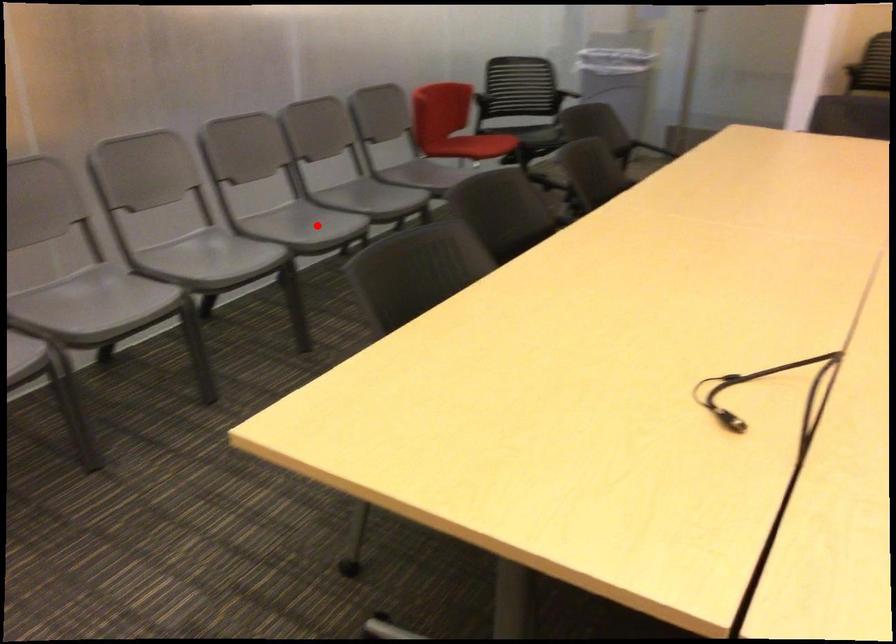
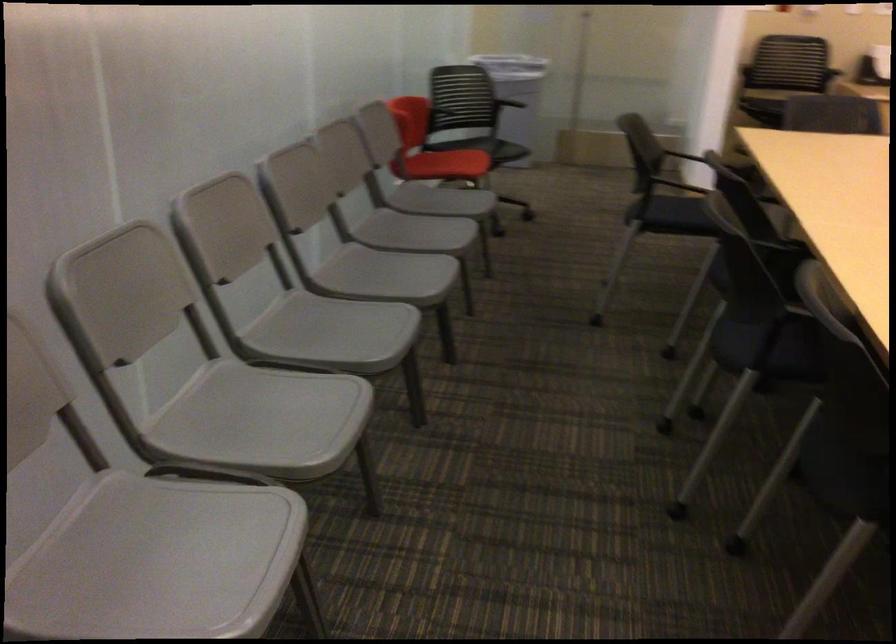
Question: I am providing you with two images of the same scene from different viewpoints. A red point is shown in image1. For the corresponding object point in image2, is it positioned nearer or farther from the camera?

Choices:
 (A) Nearer
 (B) Farther

Answer: (A)